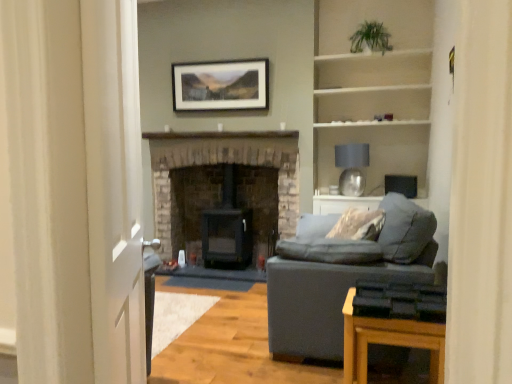
Question: Is brick fireplace at center, arranged as the 1th fireplace when viewed from the left, beside matte black picture frame at upper center?

Choices:
 (A) no
 (B) yes

Answer: (A)

Question: Is brick fireplace at center, positioned as the second fireplace in right-to-left order, positioned far away from matte black picture frame at upper center?

Choices:
 (A) no
 (B) yes

Answer: (A)

Question: Considering the relative positions of brick fireplace at center, positioned as the second fireplace in right-to-left order, and matte black picture frame at upper center in the image provided, is brick fireplace at center, positioned as the second fireplace in right-to-left order, to the right of matte black picture frame at upper center from the viewer's perspective?

Choices:
 (A) yes
 (B) no

Answer: (A)

Question: From a real-world perspective, is brick fireplace at center, positioned as the second fireplace in right-to-left order, beneath matte black picture frame at upper center?

Choices:
 (A) no
 (B) yes

Answer: (B)

Question: Is brick fireplace at center, arranged as the 1th fireplace when viewed from the left, shorter than matte black picture frame at upper center?

Choices:
 (A) no
 (B) yes

Answer: (A)

Question: Is brick fireplace at center, positioned as the second fireplace in right-to-left order, looking in the opposite direction of matte black picture frame at upper center?

Choices:
 (A) no
 (B) yes

Answer: (A)

Question: Can white glossy door at left be found inside white wooden shelves at upper right?

Choices:
 (A) yes
 (B) no

Answer: (B)

Question: From a real-world perspective, is white wooden shelves at upper right physically below white glossy door at left?

Choices:
 (A) no
 (B) yes

Answer: (A)

Question: Is white wooden shelves at upper right at the left side of white glossy door at left?

Choices:
 (A) no
 (B) yes

Answer: (A)

Question: From the image's perspective, would you say white wooden shelves at upper right is shown under white glossy door at left?

Choices:
 (A) yes
 (B) no

Answer: (B)

Question: Could you tell me if white wooden shelves at upper right is facing white glossy door at left?

Choices:
 (A) yes
 (B) no

Answer: (A)

Question: Is white wooden shelves at upper right in front of white glossy door at left?

Choices:
 (A) yes
 (B) no

Answer: (B)

Question: Is matte black picture frame at upper center at the back of matte gray fabric couch at right?

Choices:
 (A) no
 (B) yes

Answer: (A)